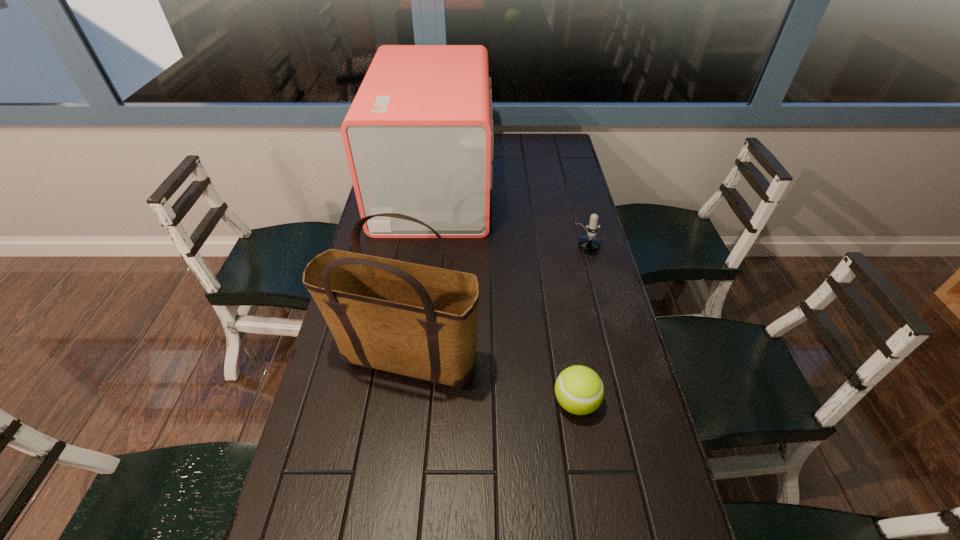
Find the location of a particular element. The width and height of the screenshot is (960, 540). object that is at the far edge is located at coordinates (418, 137).

Locate an element on the screen. The width and height of the screenshot is (960, 540). box positioned at the left edge is located at coordinates (418, 137).

Find the location of a particular element. The width and height of the screenshot is (960, 540). tote bag that is at the left edge is located at coordinates (416, 320).

Find the location of a particular element. The height and width of the screenshot is (540, 960). microphone that is at the right edge is located at coordinates (589, 243).

Identify the location of tennis ball that is at the right edge. (579, 390).

Locate an element on the screen. object at the far left corner is located at coordinates (418, 137).

Where is `blank space at the left edge of the desktop`? blank space at the left edge of the desktop is located at coordinates (391, 376).

The image size is (960, 540). I want to click on free space at the right edge of the desktop, so click(x=554, y=211).

At what (x,y) coordinates should I click in order to perform the action: click on free space between the tote bag and the second object from right to left. Please return your answer as a coordinate pair (x, y). Looking at the image, I should click on (491, 381).

The image size is (960, 540). What are the coordinates of `free spot between the rightmost object and the tote bag` in the screenshot? It's located at (495, 299).